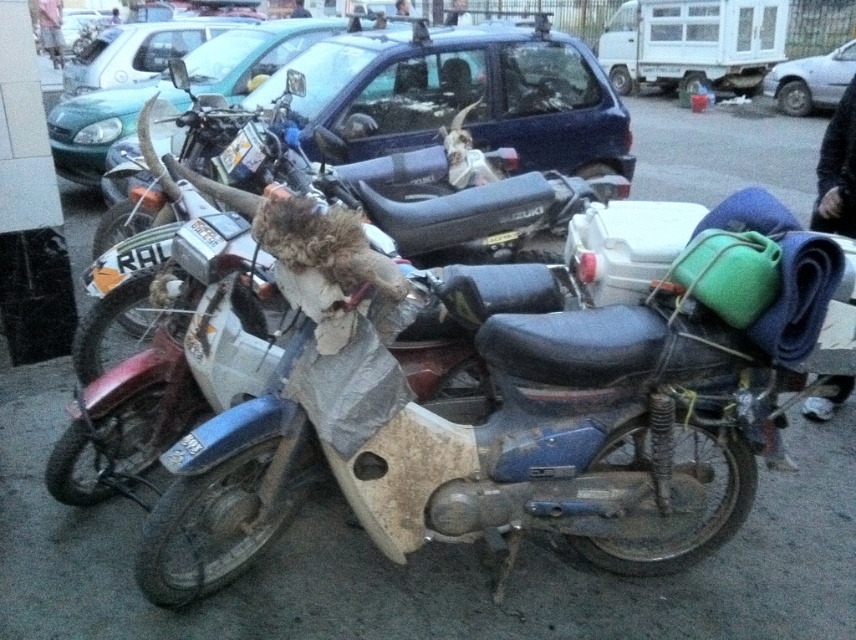
Looking at this image, you are a delivery person trying to park a new motorcycle between the green matte car at upper left and the metallic silver car at upper center. Based on their heights, which car should you position the motorcycle closer to ensure it doesn

The green matte car at upper left is taller than the metallic silver car at upper center. To ensure the motorcycle has enough clearance, you should position it closer to the metallic silver car at upper center since it is shorter.

You are standing at the parking area and want to locate two specific points marked in the image. The first point is at coordinates point (217, 60), and the second is at point (837, 65). From your position, which point is closer to you?

Point (217, 60) is in front of point (837, 65), so the first point is closer to you.

You are a delivery person trying to park your van between the green matte car at upper left and the metallic silver car at upper center. Can you fit your van there if the space between them is only 1.5 meters wide?

The space between the green matte car at upper left and the metallic silver car at upper center is 1.5 meters wide. Since the van requires at least 2 meters to park comfortably, it would not fit in this space.